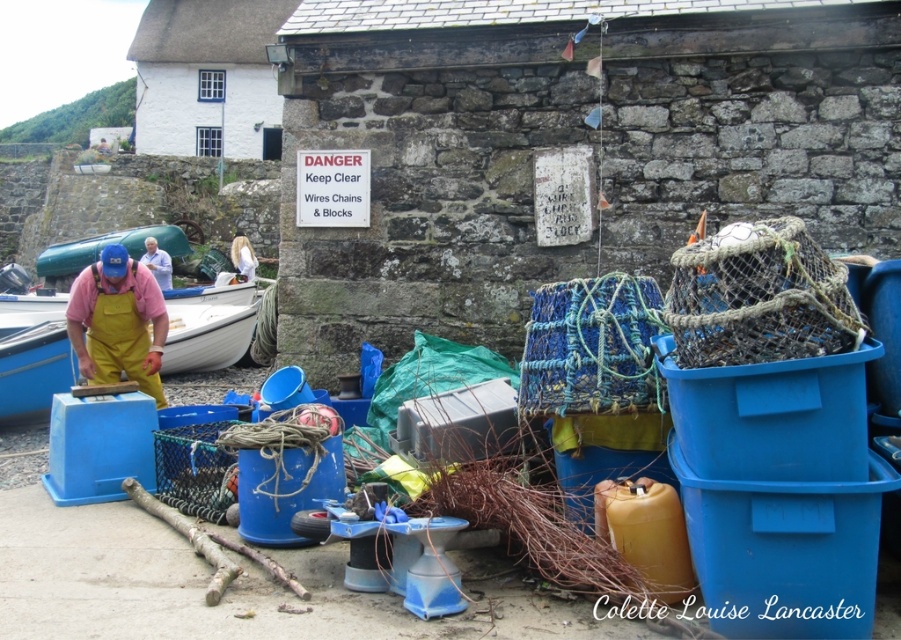
You are a safety inspector checking the harbor. You notice the yellow rubber overalls at left and the green plastic boat at upper left. Which object takes up more space in the scene?

The green plastic boat at upper left takes up more space in the scene because the yellow rubber overalls at left occupies less space than it.

You are a visitor at the harbor and see the blue fabric at center and the white fabric shirt at center. Which fabric is positioned to the left side?

The blue fabric at center is positioned to the left of the white fabric shirt at center.